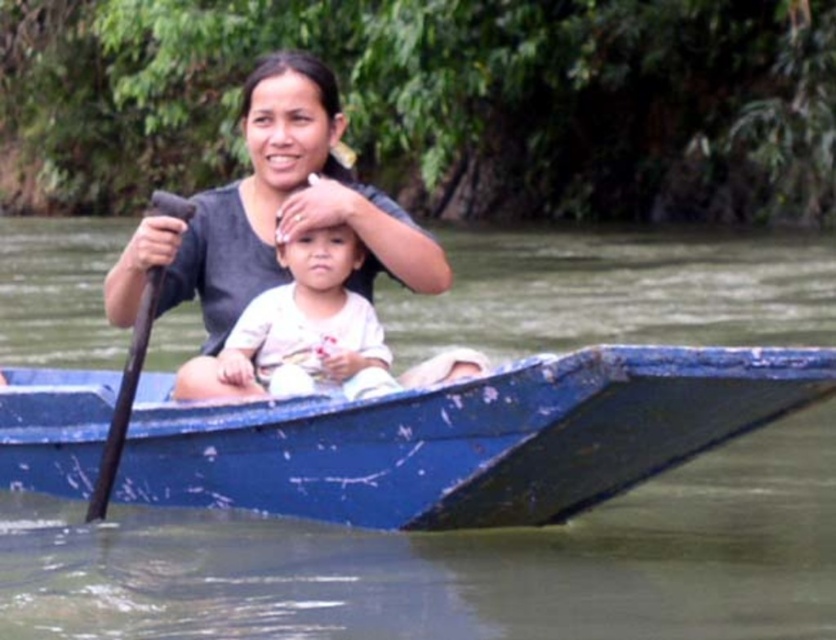
Between blue painted wood canoe at center and white cotton baby at center, which one appears on the right side from the viewer's perspective?

Positioned to the right is white cotton baby at center.

In the scene shown: Does blue painted wood canoe at center have a lesser height compared to white cotton baby at center?

No, blue painted wood canoe at center is not shorter than white cotton baby at center.

Does point (34, 481) come farther from viewer compared to point (289, 336)?

Yes, point (34, 481) is behind point (289, 336).

The height and width of the screenshot is (640, 836). What are the coordinates of `blue painted wood canoe at center` in the screenshot? It's located at (466, 436).

Can you confirm if blue painted wood canoe at center is thinner than matte black shirt at center?

No, blue painted wood canoe at center is not thinner than matte black shirt at center.

Which is behind, point (505, 476) or point (253, 80)?

The point (253, 80) is behind.

This screenshot has width=836, height=640. I want to click on blue painted wood canoe at center, so click(x=466, y=436).

Based on the photo, who is lower down, greenish murky water at center or blue painted wood canoe at center?

blue painted wood canoe at center is below.

The image size is (836, 640). Find the location of `greenish murky water at center`. greenish murky water at center is located at coordinates (455, 563).

At what (x,y) coordinates should I click in order to perform the action: click on greenish murky water at center. Please return your answer as a coordinate pair (x, y). The height and width of the screenshot is (640, 836). Looking at the image, I should click on (455, 563).